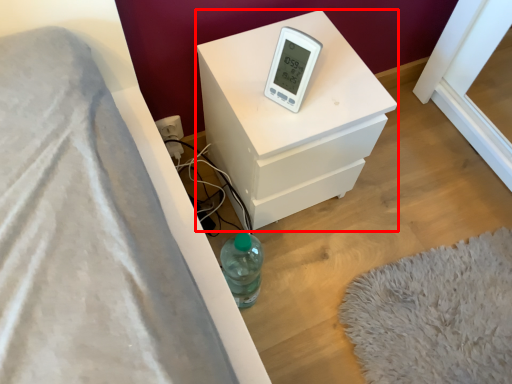
Question: From the image's perspective, where is nightstand (annotated by the red box) located relative to thermometer?

Choices:
 (A) above
 (B) below

Answer: (B)